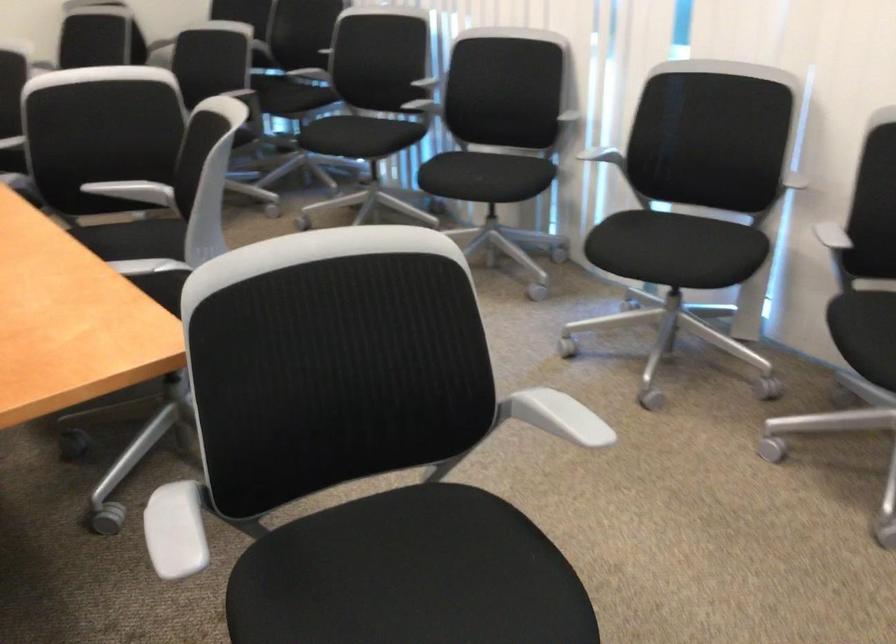
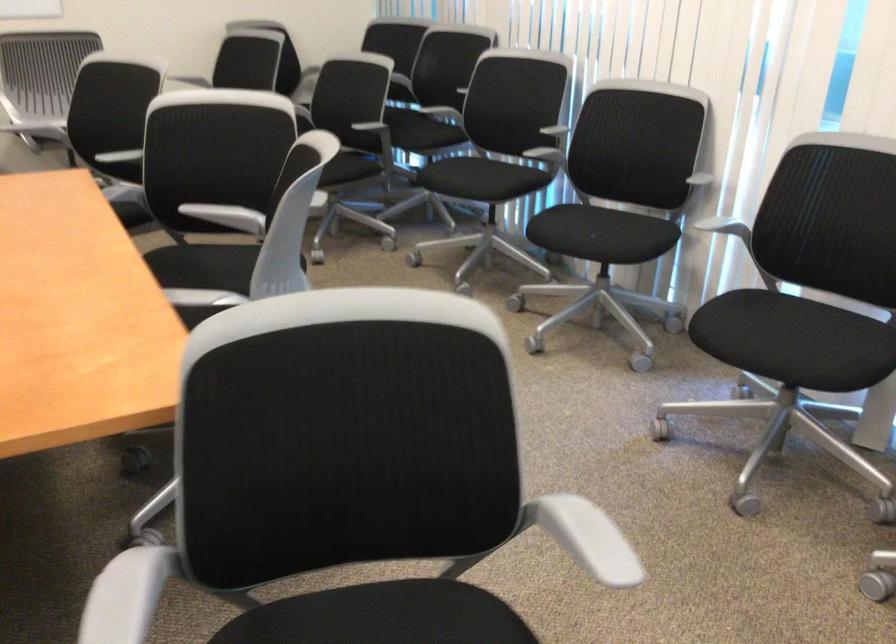
Where in the second image is the point corresponding to (x=364, y=138) from the first image?

(480, 178)